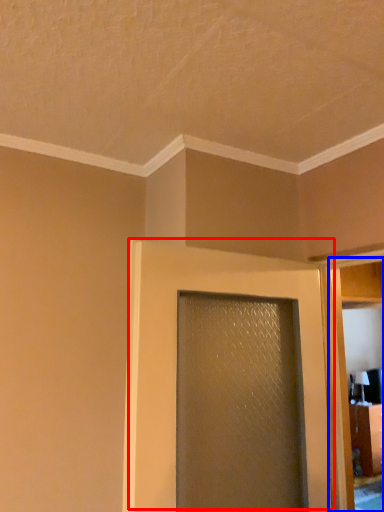
Question: Which point is closer to the camera, door (highlighted by a red box) or elevator (highlighted by a blue box)?

Choices:
 (A) door
 (B) elevator

Answer: (A)